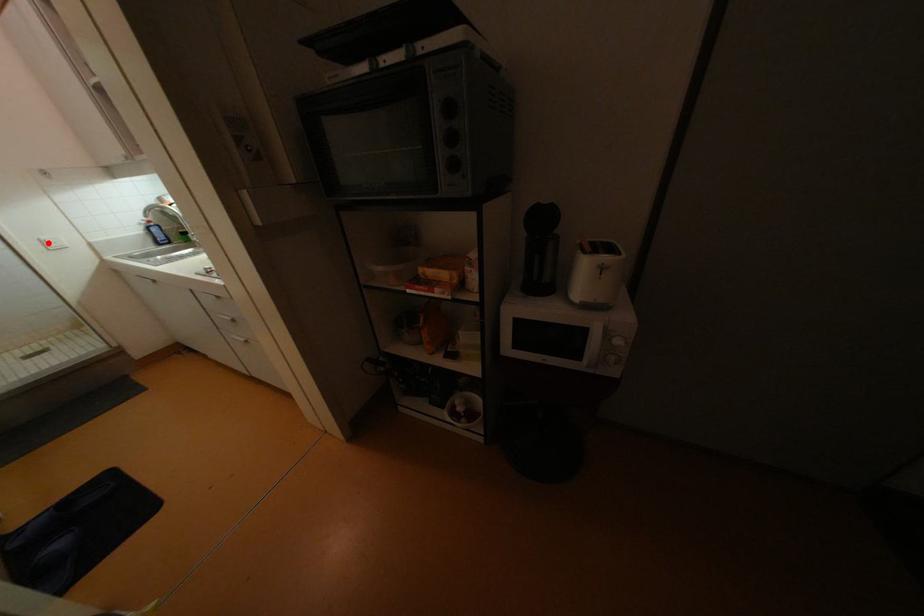
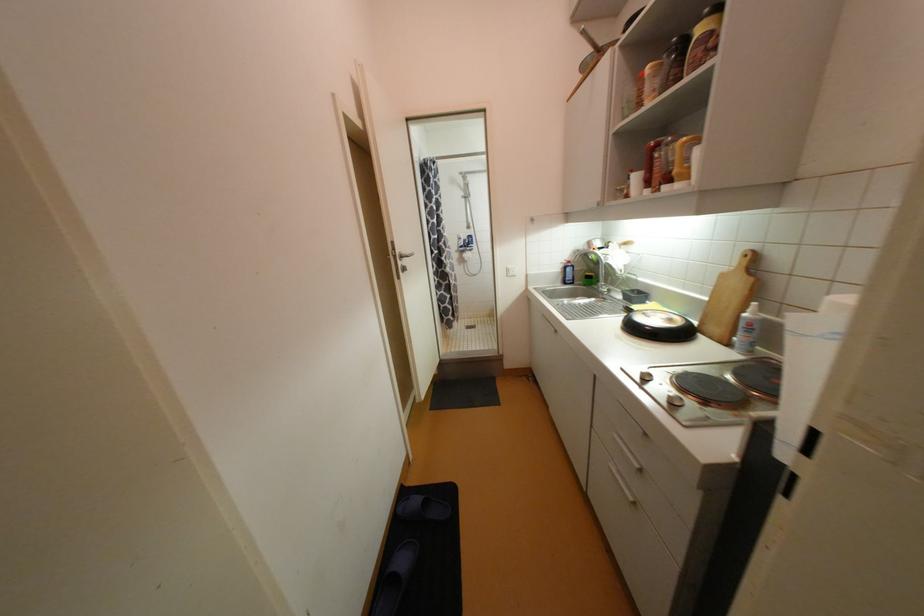
Question: A red point is marked in image1. In image2, is the corresponding 3D point closer to the camera or farther? Reply with the corresponding letter.

Choices:
 (A) The corresponding 3D point is closer.
 (B) The corresponding 3D point is farther.

Answer: (A)